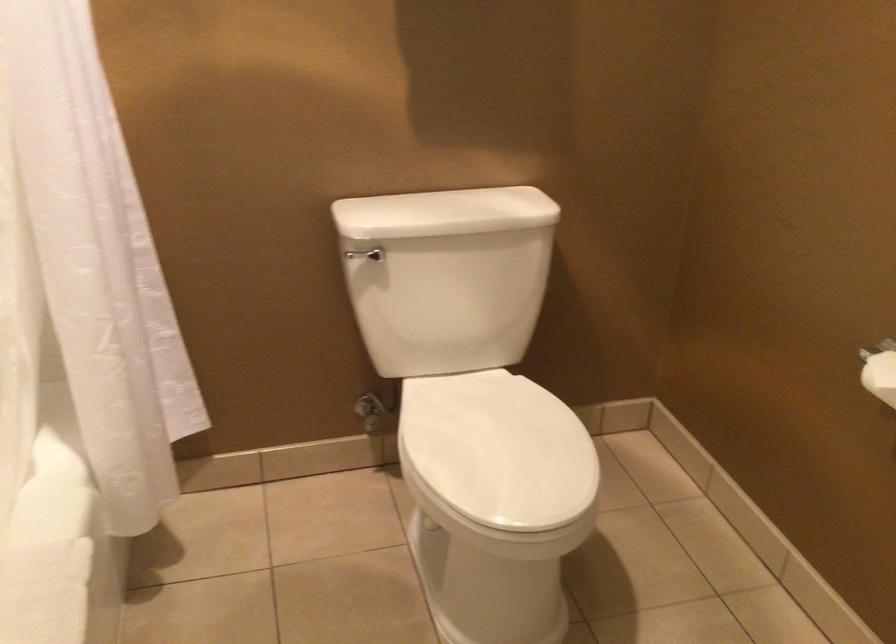
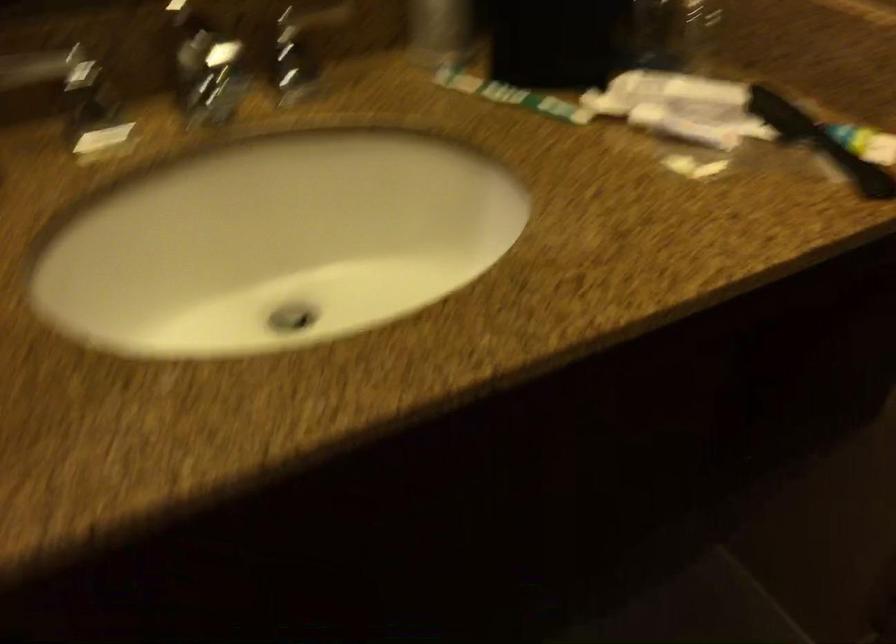
How did the camera likely rotate?

The rotation direction of the camera is right-down.